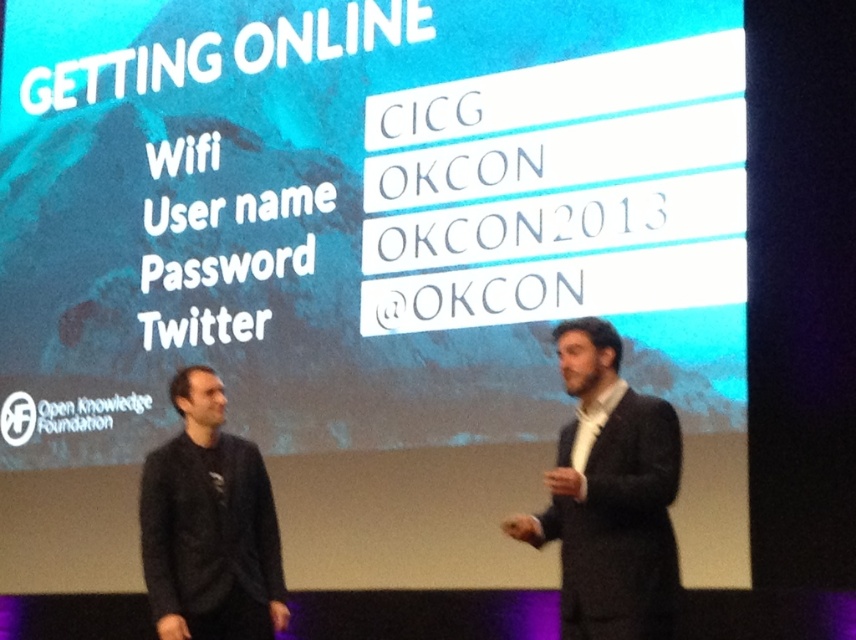
You are an event photographer at the OKCON 2013 conference. You need to capture a photo of both the black wool suit at right and the black matte sweater at left. However, your camera has a limited focus range. Based on their positions, which person should you focus on first to ensure both are in frame?

The black wool suit at right is above the black matte sweater at left, so you should focus on the black wool suit at right first to ensure both are within the camera frame.

You are an event photographer at the OKCON 2013 conference. You need to capture a photo of both the black wool suit at right and the black matte sweater at left. The stage has a limited space, so you must position yourself in a way that both are visible. Based on their positions, which side of the stage should you stand to ensure both are in frame?

You should position yourself to the left of both the black wool suit at right and the black matte sweater at left. Since the black wool suit at right is to the right of the black matte sweater at left, standing to the left side will allow you to see both individuals in the frame.